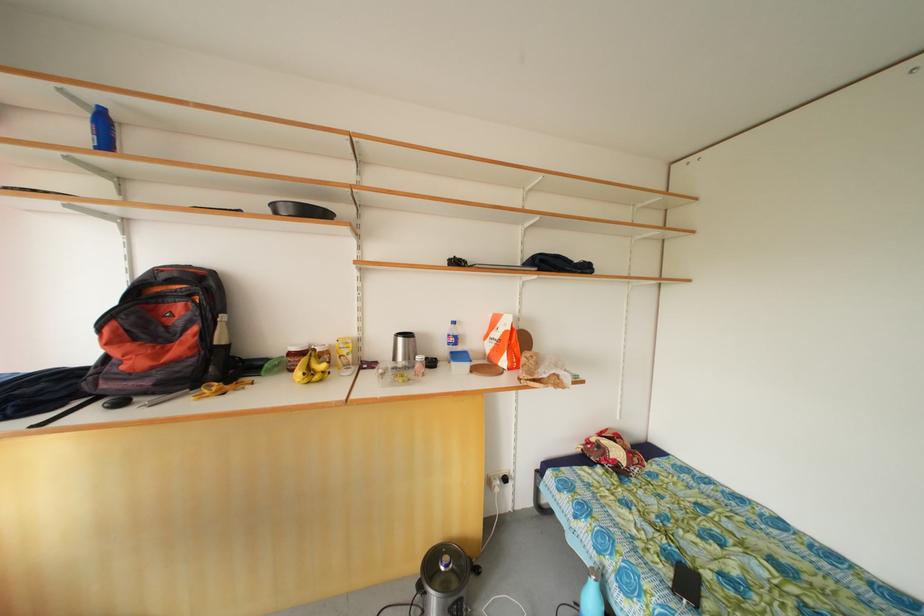
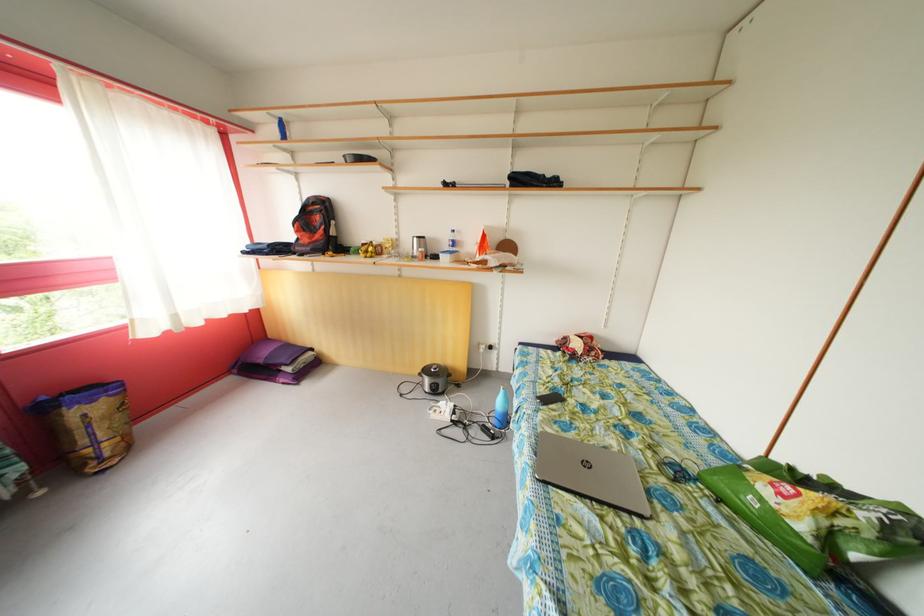
What movement of the cameraman would produce the second image?

The cameraman walked toward right, backward.